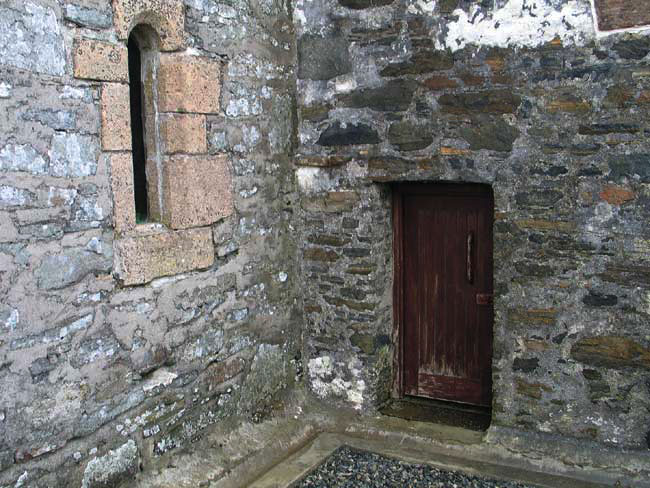
The height and width of the screenshot is (488, 650). In order to click on door handle in this screenshot , I will do `click(467, 250)`.